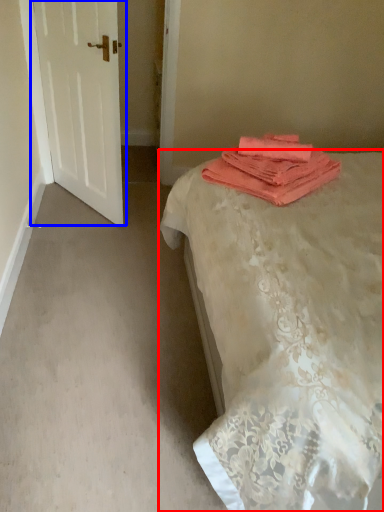
Question: Among these objects, which one is farthest to the camera, bed (highlighted by a red box) or door (highlighted by a blue box)?

Choices:
 (A) bed
 (B) door

Answer: (B)